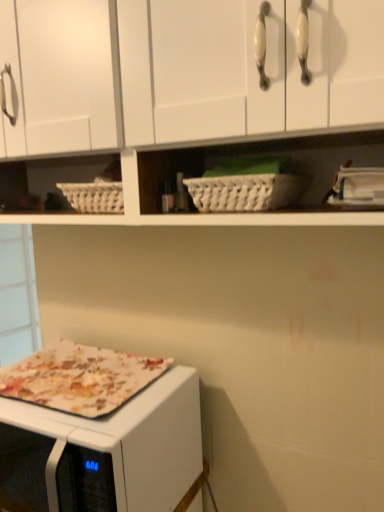
The width and height of the screenshot is (384, 512). Identify the location of blank space situated above printed fabric pizza at lower left (from a real-world perspective). (92, 367).